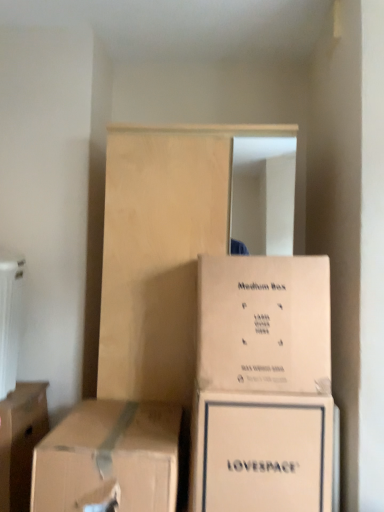
Question: In which direction should I rotate to look at white cardboard box at lower center, arranged as the 2th box when viewed from the right?

Choices:
 (A) left
 (B) right

Answer: (B)

Question: From a real-world perspective, is brown cardboard box at lower left, acting as the 2th box starting from the left, positioned under white plastic radiator at left based on gravity?

Choices:
 (A) yes
 (B) no

Answer: (A)

Question: Does brown cardboard box at lower left, arranged as the 3th box when viewed from the right, have a larger size compared to white plastic radiator at left?

Choices:
 (A) yes
 (B) no

Answer: (A)

Question: From a real-world perspective, is brown cardboard box at lower left, arranged as the 3th box when viewed from the right, located higher than white plastic radiator at left?

Choices:
 (A) yes
 (B) no

Answer: (B)

Question: Is brown cardboard box at lower left, arranged as the 3th box when viewed from the right, far away from white plastic radiator at left?

Choices:
 (A) yes
 (B) no

Answer: (B)

Question: Does brown cardboard box at lower left, acting as the 2th box starting from the left, have a lesser height compared to white plastic radiator at left?

Choices:
 (A) no
 (B) yes

Answer: (B)

Question: Could you tell me if brown cardboard box at lower left, acting as the 2th box starting from the left, is turned towards white plastic radiator at left?

Choices:
 (A) yes
 (B) no

Answer: (B)

Question: Does beige cardboard box at center, acting as the first box starting from the right, have a greater width compared to brown cardboard box at lower left, arranged as the first box when viewed from the left?

Choices:
 (A) yes
 (B) no

Answer: (A)

Question: Is beige cardboard box at center, arranged as the fourth box when viewed from the left, facing away from brown cardboard box at lower left, the fourth box viewed from the right?

Choices:
 (A) yes
 (B) no

Answer: (B)

Question: Is beige cardboard box at center, arranged as the fourth box when viewed from the left, taller than brown cardboard box at lower left, arranged as the first box when viewed from the left?

Choices:
 (A) yes
 (B) no

Answer: (B)

Question: Does beige cardboard box at center, acting as the first box starting from the right, lie in front of brown cardboard box at lower left, arranged as the first box when viewed from the left?

Choices:
 (A) no
 (B) yes

Answer: (B)

Question: From the image's perspective, would you say beige cardboard box at center, acting as the first box starting from the right, is positioned over brown cardboard box at lower left, arranged as the first box when viewed from the left?

Choices:
 (A) no
 (B) yes

Answer: (B)

Question: Can you confirm if beige cardboard box at center, acting as the first box starting from the right, is shorter than brown cardboard box at lower left, the fourth box viewed from the right?

Choices:
 (A) yes
 (B) no

Answer: (A)

Question: From the image's perspective, does light wood dresser at center appear lower than brown cardboard box at lower left, the fourth box viewed from the right?

Choices:
 (A) no
 (B) yes

Answer: (A)